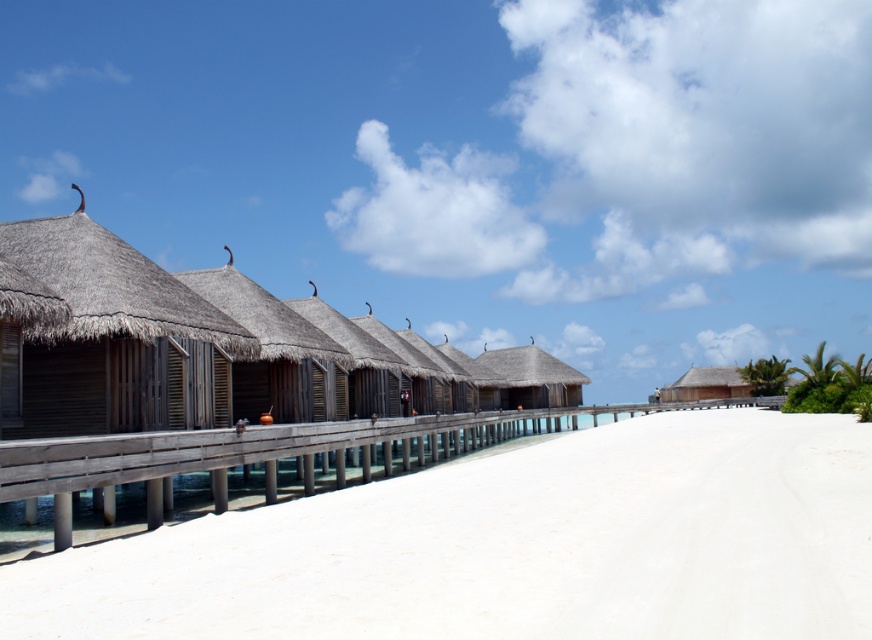
Is wooden at center below thatched wood hut at center?

Correct, wooden at center is located below thatched wood hut at center.

Which is below, wooden at center or thatched wood hut at center?

wooden at center is lower down.

Image resolution: width=872 pixels, height=640 pixels. What do you see at coordinates (233, 458) in the screenshot? I see `wooden at center` at bounding box center [233, 458].

Find the location of a particular element. The height and width of the screenshot is (640, 872). wooden at center is located at coordinates (233, 458).